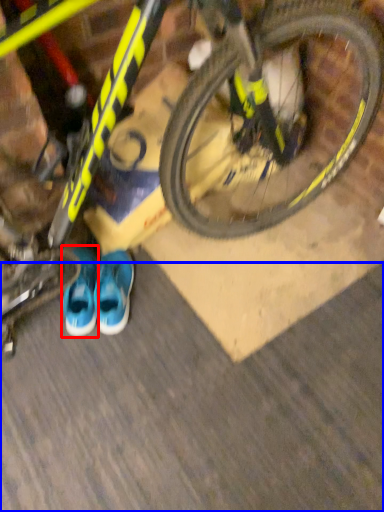
Question: Which point is closer to the camera, footwear (highlighted by a red box) or dirt track (highlighted by a blue box)?

Choices:
 (A) footwear
 (B) dirt track

Answer: (B)